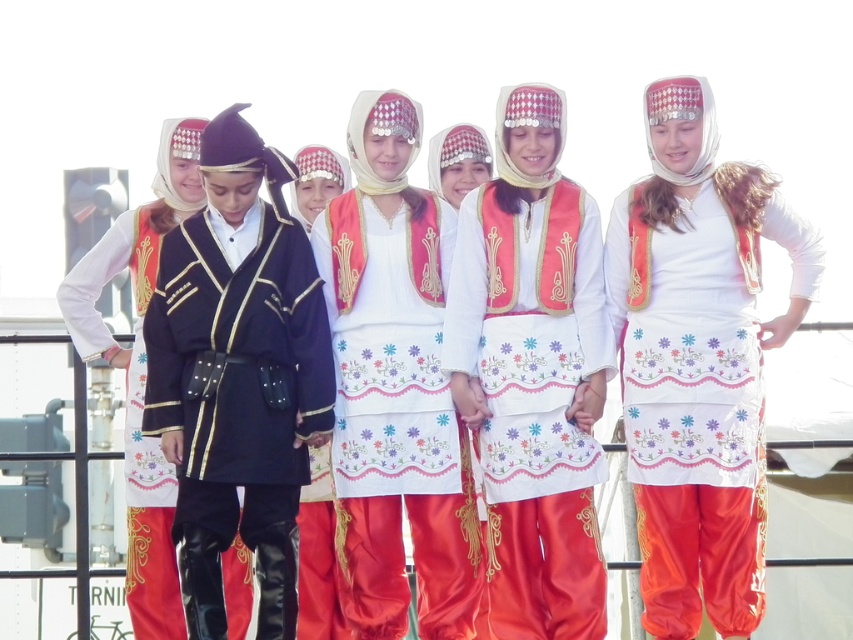
Question: Which object is the farthest from the shiny black coat at center?

Choices:
 (A) white satin skirt at center
 (B) embroidered silk dress at center

Answer: (A)

Question: Based on their relative distances, which object is nearer to the white satin skirt at center?

Choices:
 (A) matte black vest at left
 (B) white satin dress at center

Answer: (B)

Question: Can you confirm if shiny black coat at center is wider than matte black vest at left?

Choices:
 (A) no
 (B) yes

Answer: (A)

Question: Among these points, which one is farthest from the camera?

Choices:
 (A) (305, 388)
 (B) (549, 515)

Answer: (A)

Question: Is white satin skirt at center wider than white satin dress at center?

Choices:
 (A) yes
 (B) no

Answer: (A)

Question: Does white satin skirt at center appear on the left side of white satin dress at center?

Choices:
 (A) yes
 (B) no

Answer: (B)